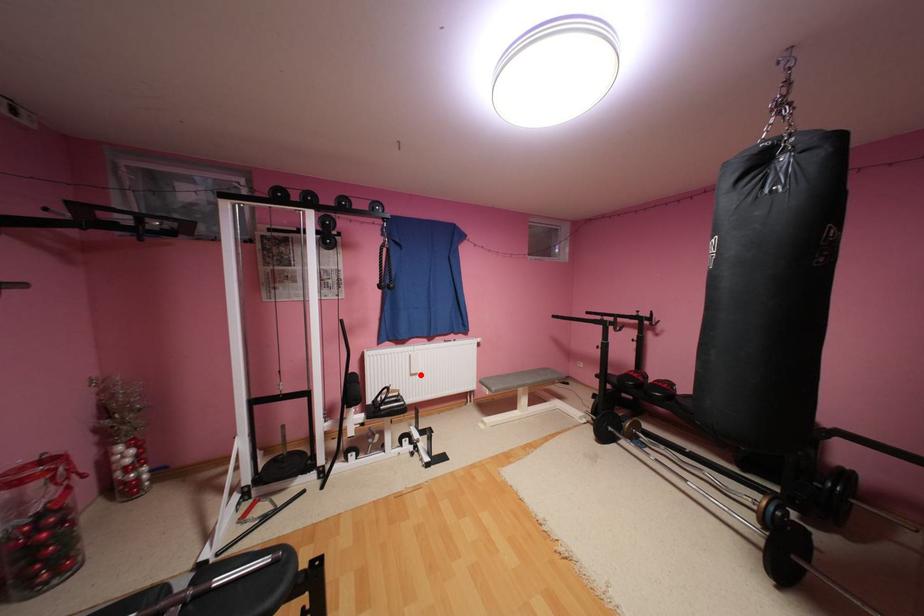
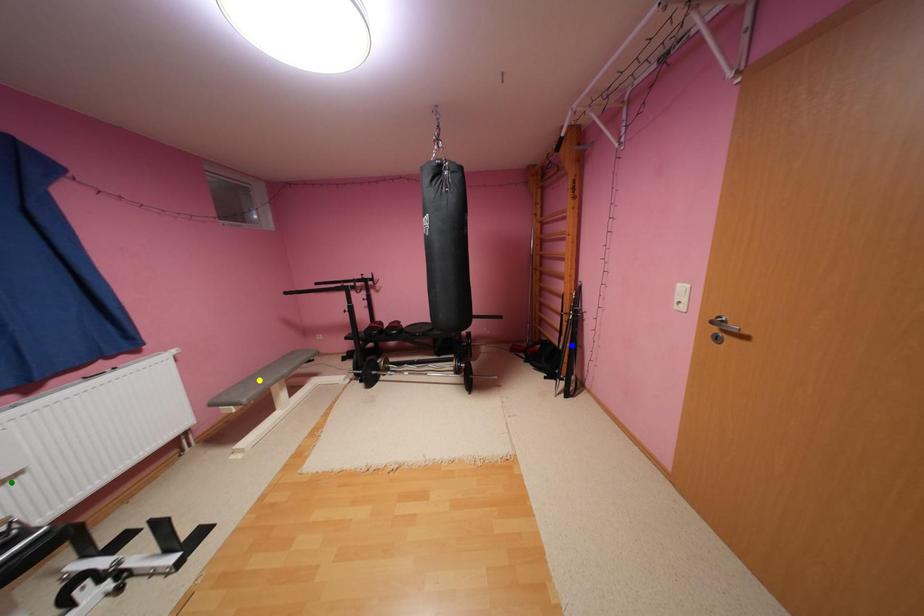
Question: I am providing you with two images of the same scene from different viewpoints. A red point is marked on the first image. You are given multiple points on the second image. Which mark in image 2 goes with the point in image 1?

Choices:
 (A) blue point
 (B) yellow point
 (C) green point

Answer: (C)